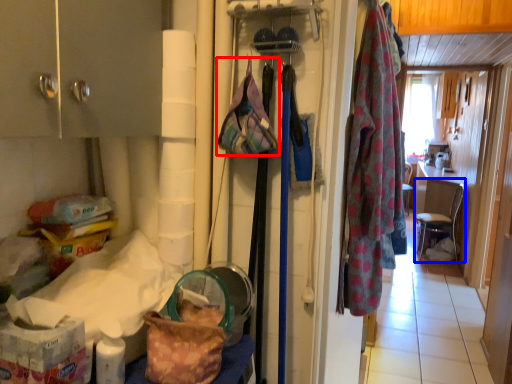
Question: Among these objects, which one is farthest to the camera, handbag (highlighted by a red box) or chair (highlighted by a blue box)?

Choices:
 (A) handbag
 (B) chair

Answer: (B)